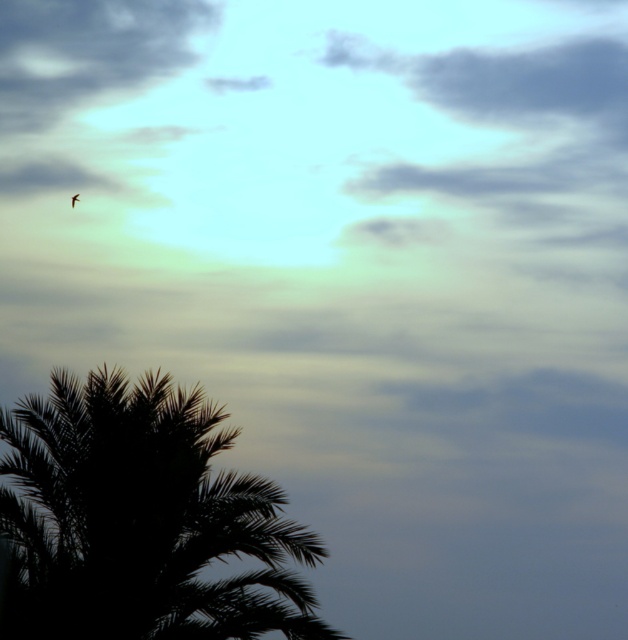
Question: Which object is farther from the camera taking this photo?

Choices:
 (A) brown feathered bird at upper left
 (B) gray fluffy cloud at upper center
 (C) black silhouette palm tree at lower left

Answer: (A)

Question: Is black silhouette palm tree at lower left positioned before gray fluffy cloud at upper center?

Choices:
 (A) yes
 (B) no

Answer: (A)

Question: Considering the real-world distances, which object is closest to the black silhouette palm tree at lower left?

Choices:
 (A) brown feathered bird at upper left
 (B) gray fluffy cloud at upper center

Answer: (A)

Question: Is gray fluffy cloud at upper center in front of brown feathered bird at upper left?

Choices:
 (A) no
 (B) yes

Answer: (B)

Question: Which is farther from the gray fluffy cloud at upper center?

Choices:
 (A) brown feathered bird at upper left
 (B) black silhouette palm tree at lower left

Answer: (B)

Question: From the image, what is the correct spatial relationship of black silhouette palm tree at lower left in relation to brown feathered bird at upper left?

Choices:
 (A) below
 (B) above

Answer: (A)